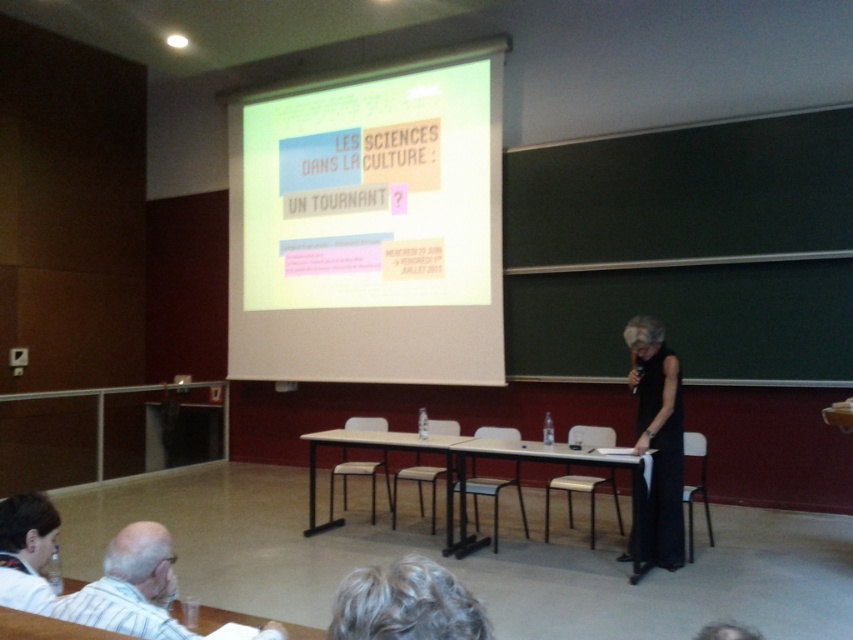
Question: Among these points, which one is farthest from the camera?

Choices:
 (A) (657, 378)
 (B) (425, 440)
 (C) (467, 317)

Answer: (C)

Question: Does white matte projection screen at upper center appear over light brown wooden table at center?

Choices:
 (A) no
 (B) yes

Answer: (B)

Question: Based on their relative distances, which object is nearer to the light brown wood table at center?

Choices:
 (A) light brown wooden table at center
 (B) wooden table at center
 (C) white matte projection screen at upper center

Answer: (A)

Question: Can you confirm if light brown wooden table at center is positioned to the left of wooden table at center?

Choices:
 (A) yes
 (B) no

Answer: (A)

Question: Which point is farther to the camera?

Choices:
 (A) (126, 618)
 (B) (840, 403)
 (C) (259, 272)

Answer: (C)

Question: Does light brown wood table at center appear under wooden table at center?

Choices:
 (A) no
 (B) yes

Answer: (B)